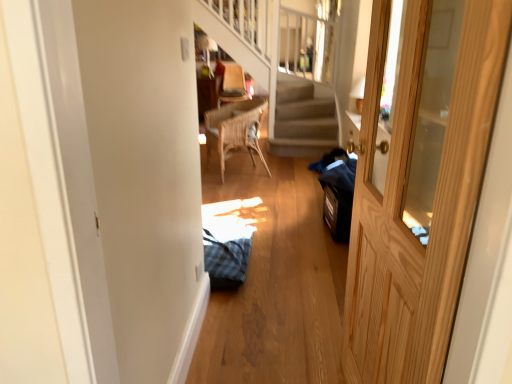
Question: Considering the relative positions of woven wood chair at center and wooden door at right in the image provided, is woven wood chair at center to the left or to the right of wooden door at right?

Choices:
 (A) left
 (B) right

Answer: (A)

Question: From a real-world perspective, is woven wood chair at center positioned above or below wooden door at right?

Choices:
 (A) below
 (B) above

Answer: (A)

Question: Estimate the real-world distances between objects in this image. Which object is closer to the woven wood chair at center?

Choices:
 (A) wooden door at right
 (B) wooden woven armchair at upper center

Answer: (B)

Question: Estimate the real-world distances between objects in this image. Which object is farther from the wooden woven armchair at upper center?

Choices:
 (A) wooden door at right
 (B) woven wood chair at center

Answer: (A)